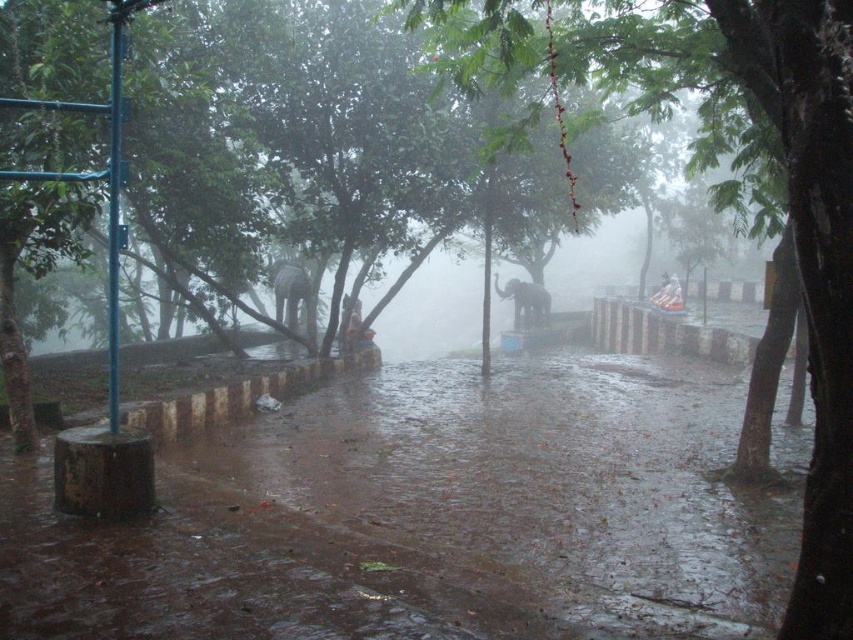
Can you confirm if green leafy tree at center is positioned below matte gray elephant at center?

No.

Who is more distant from viewer, (509, 12) or (506, 282)?

The point (506, 282) is behind.

I want to click on green leafy tree at center, so click(x=735, y=161).

Is wet concrete flood at lower center shorter than matte gray elephant at center?

Correct, wet concrete flood at lower center is not as tall as matte gray elephant at center.

Is wet concrete flood at lower center bigger than matte gray elephant at center?

Yes.

Which is in front, point (610, 358) or point (532, 305)?

Point (610, 358)

Locate an element on the screen. Image resolution: width=853 pixels, height=640 pixels. wet concrete flood at lower center is located at coordinates (427, 516).

Which is below, wet concrete flood at lower center or white plastic bag at center?

Positioned lower is wet concrete flood at lower center.

Is wet concrete flood at lower center below white plastic bag at center?

Correct, wet concrete flood at lower center is located below white plastic bag at center.

Based on the photo, who is more distant from viewer, (351, 563) or (671, 294)?

Positioned behind is point (671, 294).

This screenshot has height=640, width=853. In order to click on wet concrete flood at lower center in this screenshot , I will do `click(427, 516)`.